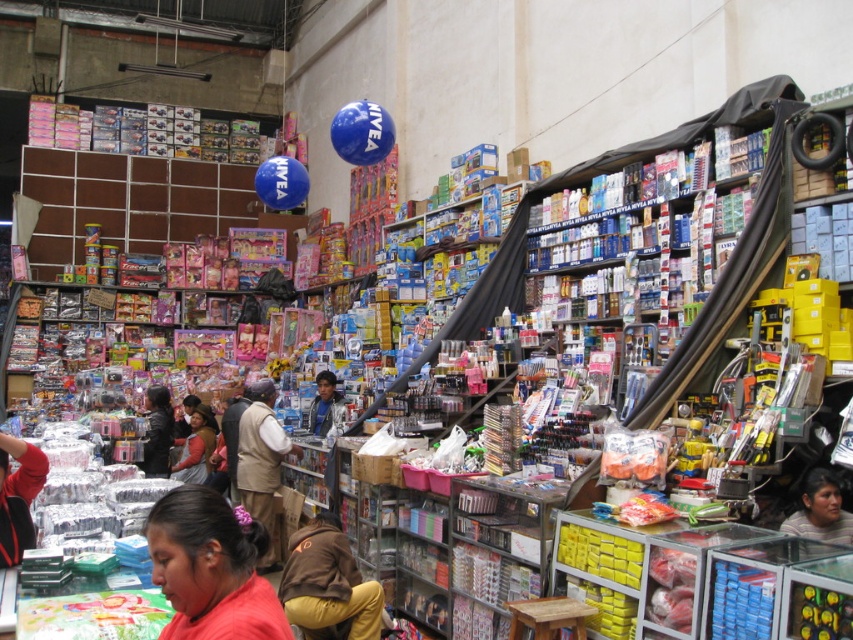
You are a customer in the store and want to approach the person in the matte brown jacket at center to ask a question. However, there is a display stand between you and them. Can you walk around the display stand to reach them from your current position near the matte red shirt at lower left?

The matte red shirt at lower left is positioned on the right side of matte brown jacket at center. Since the display stand is between you and the matte brown jacket at center, you can walk around the display stand to reach them from the right side where the matte red shirt at lower left is located.

You are a customer trying to decide between the brown fabric vest at center and the matte brown jacket at center. Which one is narrower?

The brown fabric vest at center is narrower than the matte brown jacket at center.